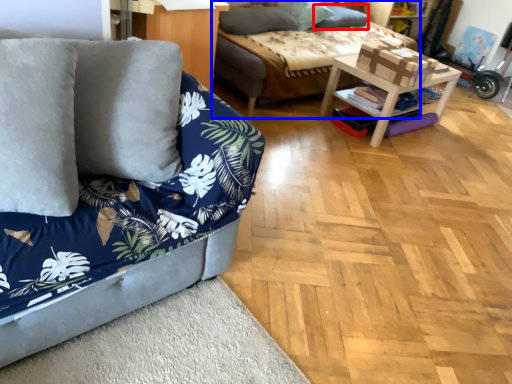
Question: Which object appears farthest to the camera in this image, pillow (highlighted by a red box) or studio couch (highlighted by a blue box)?

Choices:
 (A) pillow
 (B) studio couch

Answer: (A)